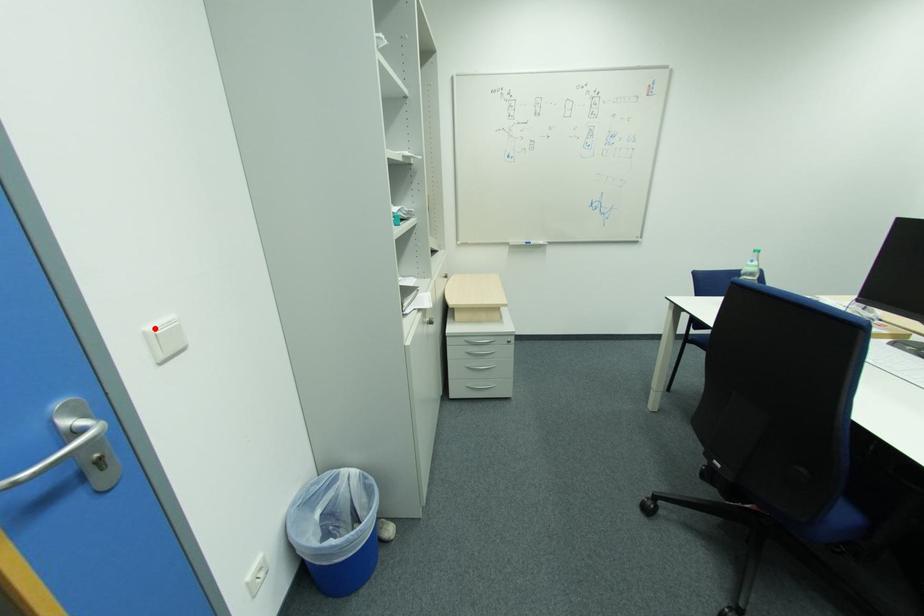
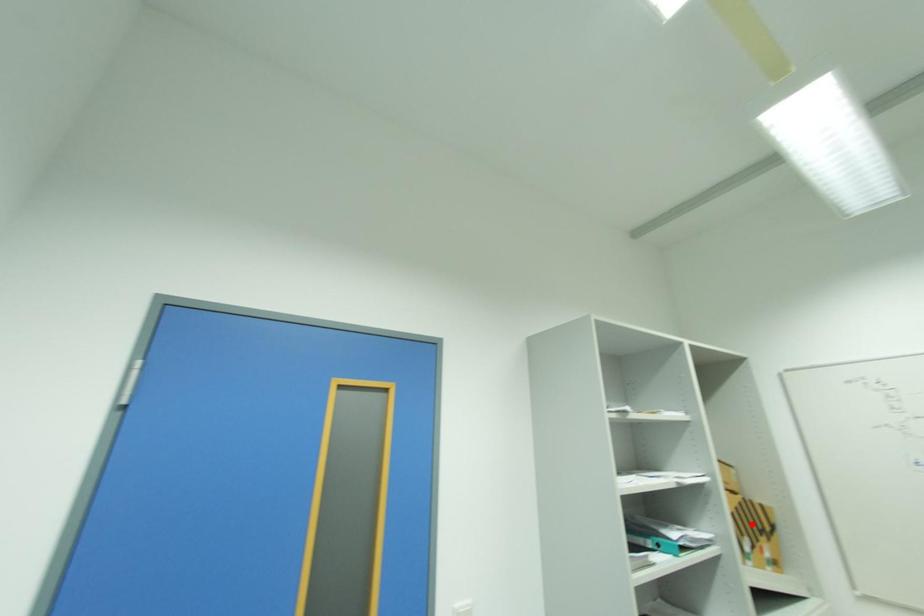
I am providing you with two images of the same scene from different viewpoints. A red point is marked on the first image and another point is marked on the second image. Do the highlighted points in image1 and image2 indicate the same real-world spot?

No